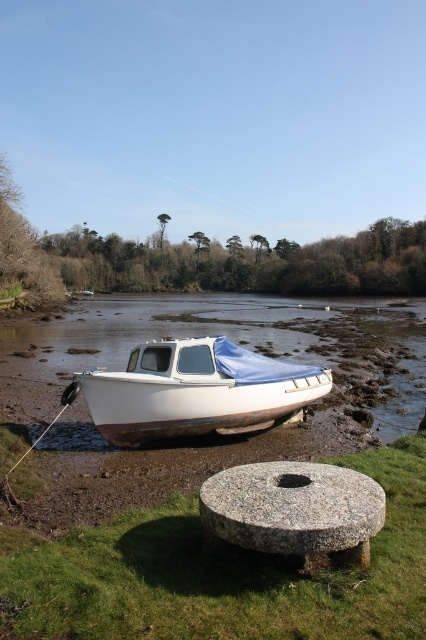
Question: Can you confirm if green grass at center is positioned above granite millstone at lower center?

Choices:
 (A) yes
 (B) no

Answer: (B)

Question: Which point is closer to the camera taking this photo?

Choices:
 (A) (245, 428)
 (B) (400, 636)

Answer: (B)

Question: Among these points, which one is farthest from the camera?

Choices:
 (A) (354, 472)
 (B) (319, 600)

Answer: (A)

Question: Which of these objects is positioned closest to the green grass at center?

Choices:
 (A) granite millstone at lower center
 (B) white matte boat at center

Answer: (A)

Question: Is green grass at center positioned before white matte boat at center?

Choices:
 (A) no
 (B) yes

Answer: (B)

Question: Is white matte boat at center positioned behind granite millstone at lower center?

Choices:
 (A) no
 (B) yes

Answer: (B)